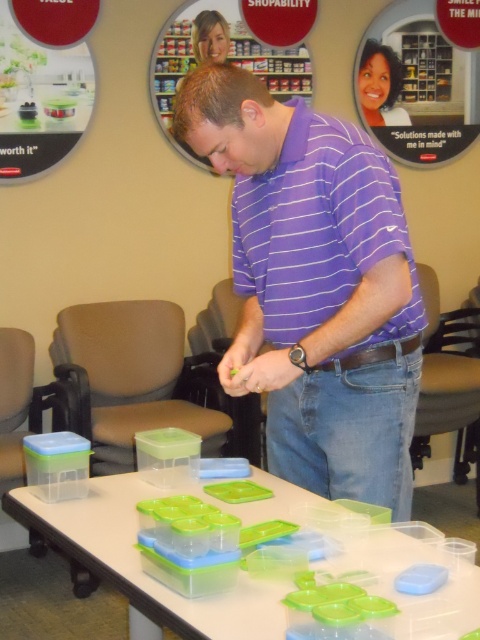
Is purple striped shirt at center bigger than clear plastic containers at center?

Yes, purple striped shirt at center is bigger than clear plastic containers at center.

Is point (337, 432) positioned in front of point (300, 499)?

No.

At what (x,y) coordinates should I click in order to perform the action: click on purple striped shirt at center. Please return your answer as a coordinate pair (x, y). This screenshot has height=640, width=480. Looking at the image, I should click on (314, 285).